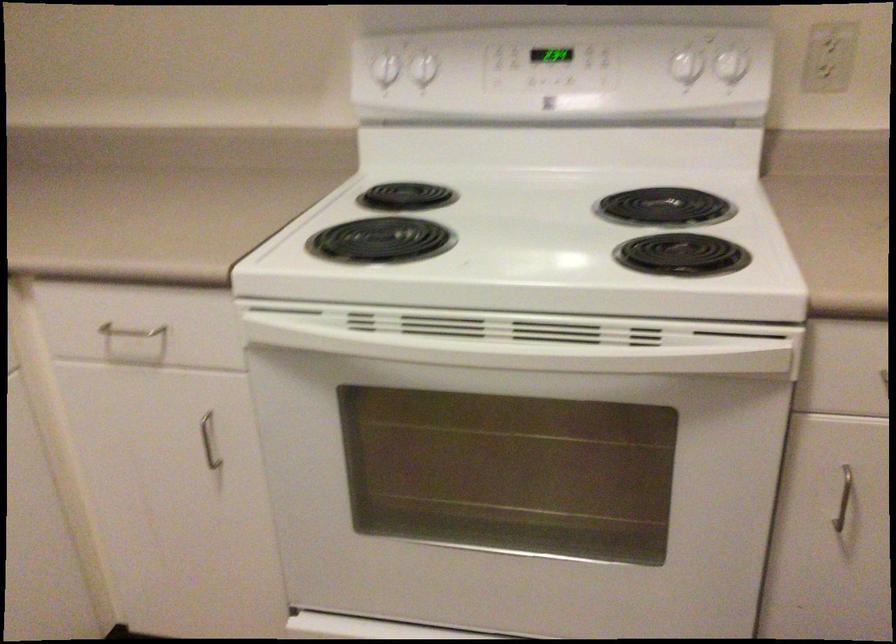
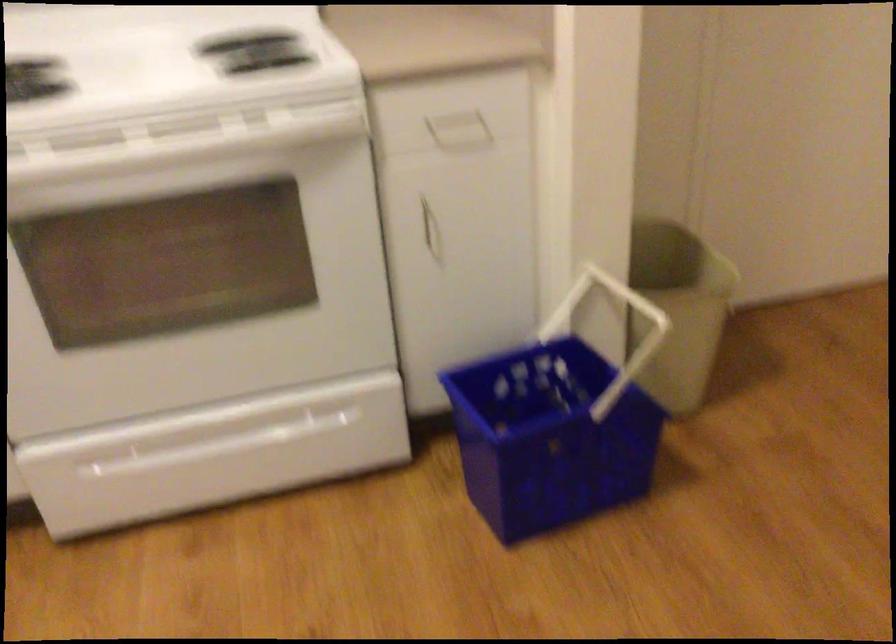
Question: In a continuous first-person perspective shot, in which direction is the camera moving?

Choices:
 (A) Left
 (B) Right
 (C) Forward
 (D) Backward

Answer: (D)